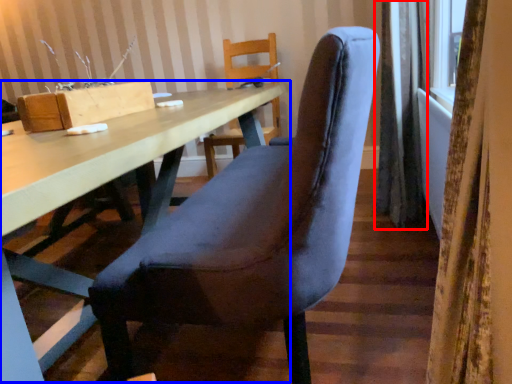
Question: Which object appears closest to the camera in this image, curtain (highlighted by a red box) or table (highlighted by a blue box)?

Choices:
 (A) curtain
 (B) table

Answer: (B)